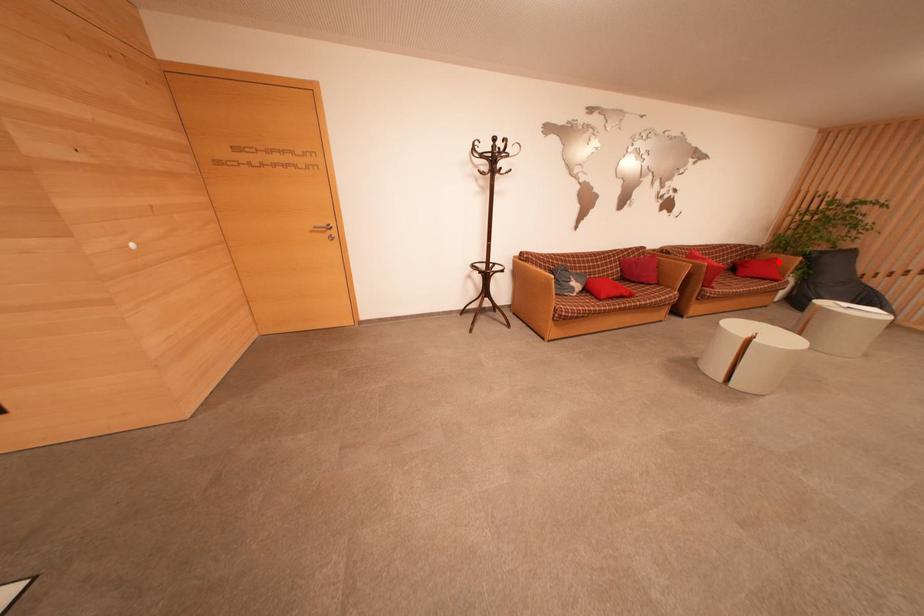
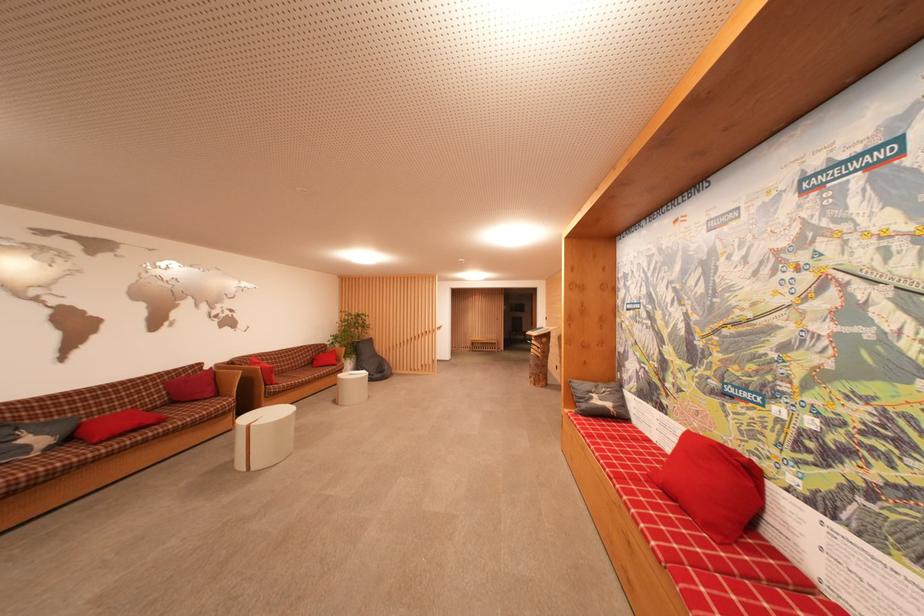
The point at the highlighted location is marked in the first image. Where is the corresponding point in the second image?

(338, 354)